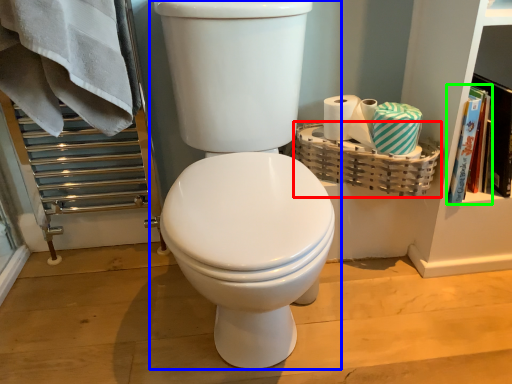
Question: Estimate the real-world distances between objects in this image. Which object is closer to basket (highlighted by a red box), toilet (highlighted by a blue box) or book (highlighted by a green box)?

Choices:
 (A) toilet
 (B) book

Answer: (B)